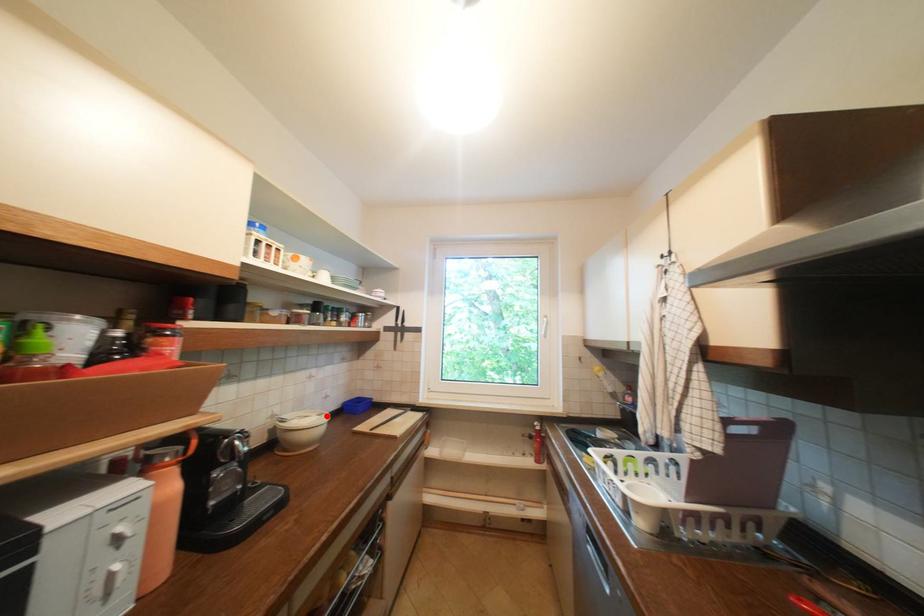
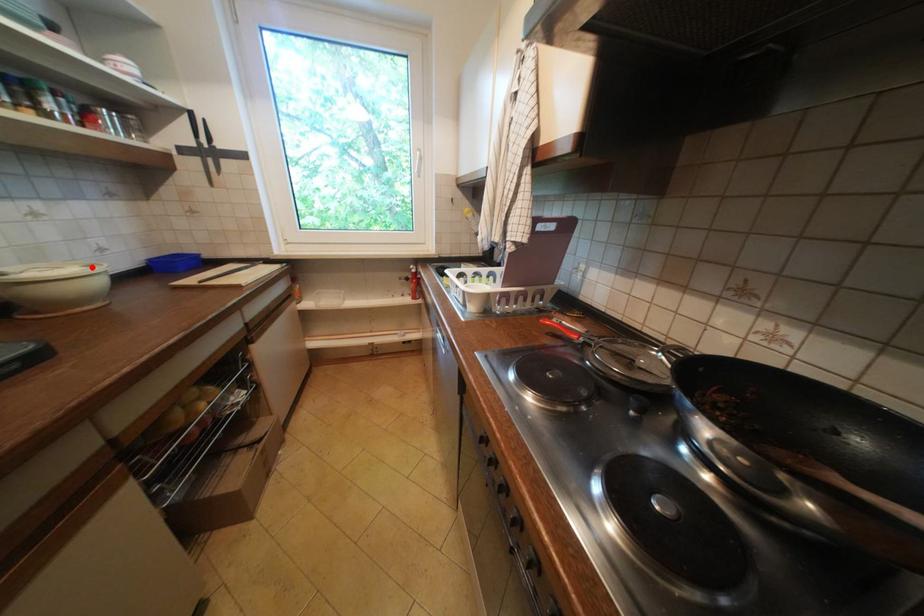
I am providing you with two images of the same scene from different viewpoints. A red point is marked on the first image and another point is marked on the second image. Does the point marked in image1 correspond to the same location as the one in image2?

Yes